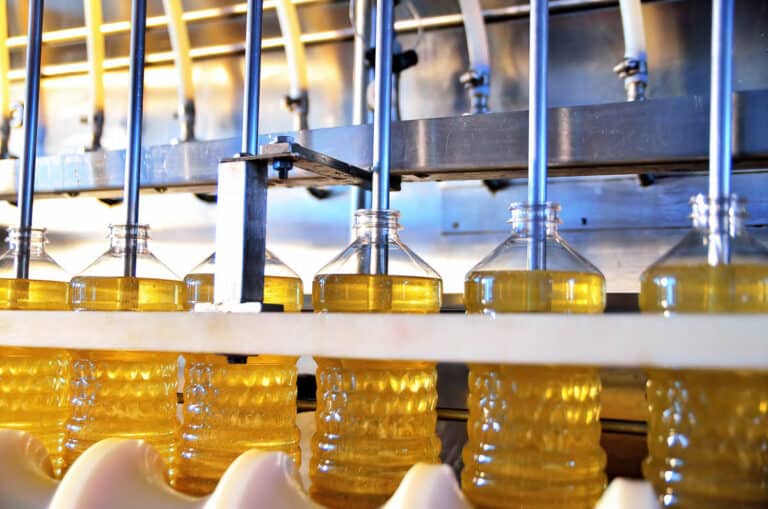
The height and width of the screenshot is (509, 768). Find the location of `rack`. rack is located at coordinates (104, 482).